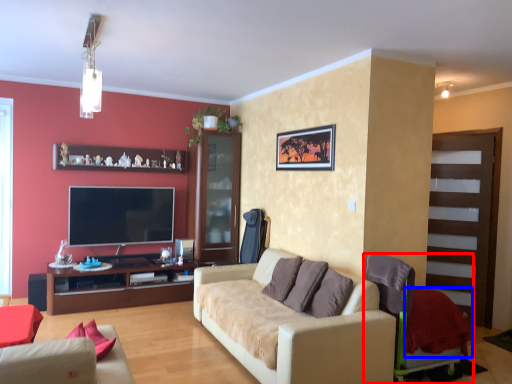
Question: Among these objects, which one is farthest to the camera, chair (highlighted by a red box) or blanket (highlighted by a blue box)?

Choices:
 (A) chair
 (B) blanket

Answer: (B)